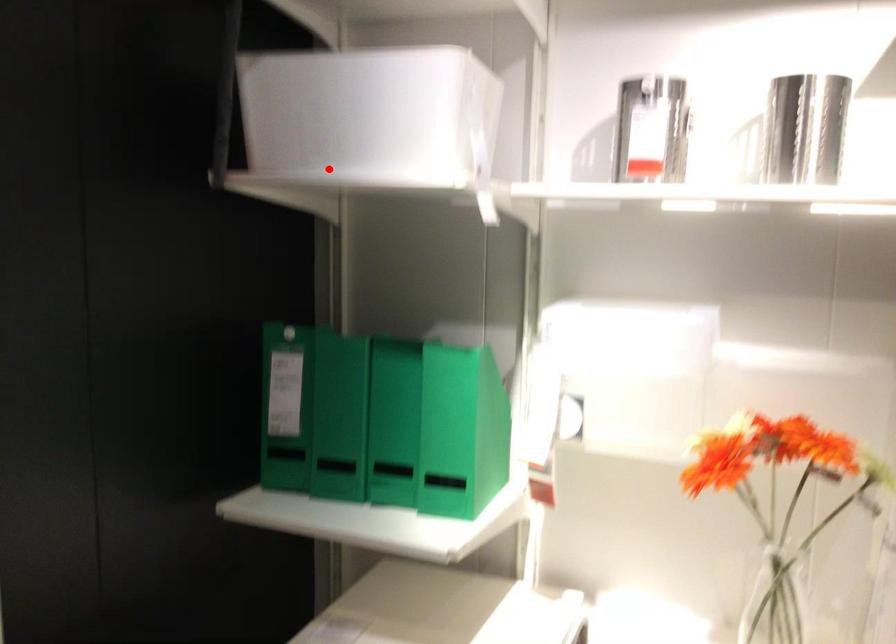
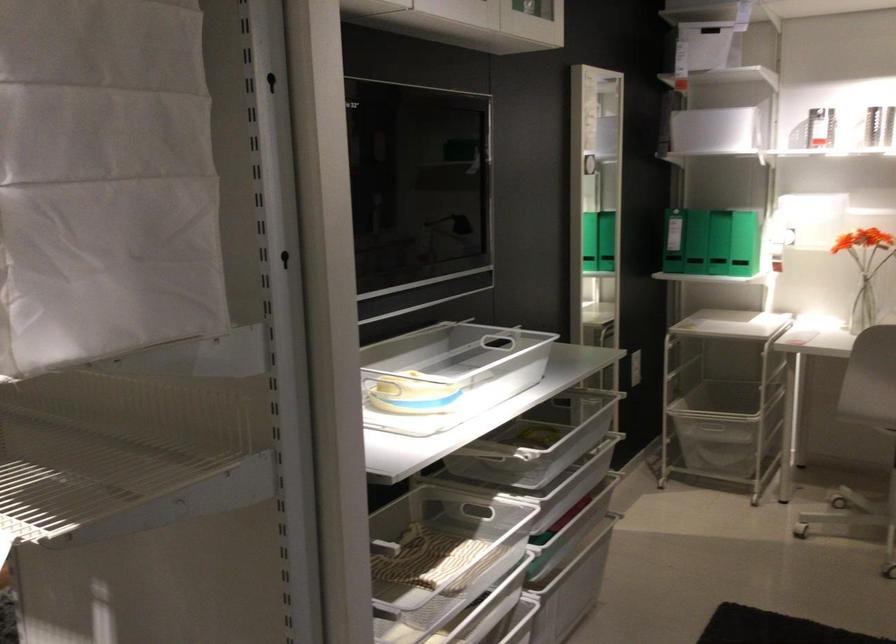
Question: I am providing you with two images of the same scene from different viewpoints. Given a red point in image1, look at the same physical point in image2. Is it:

Choices:
 (A) Closer to the viewpoint
 (B) Farther from the viewpoint

Answer: (B)